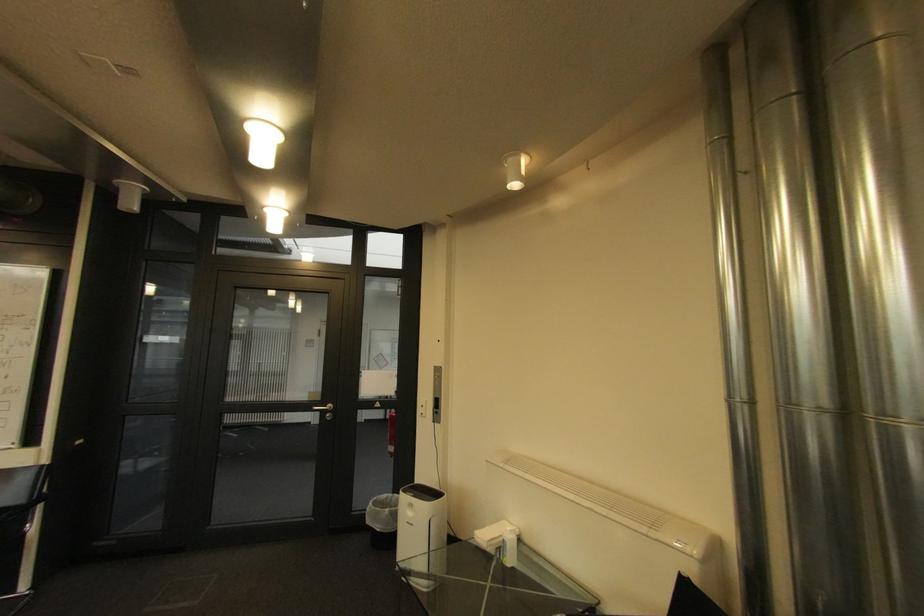
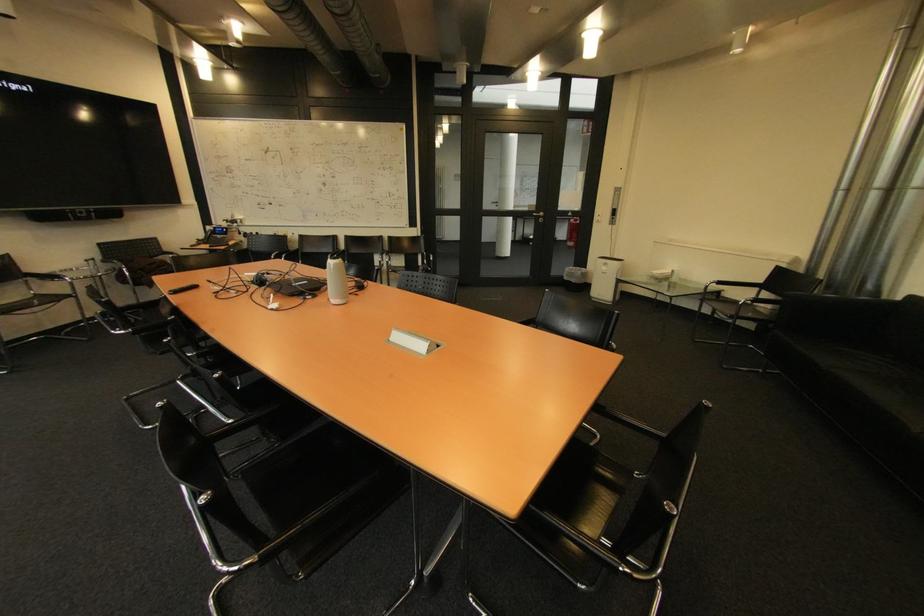
Where in the second image is the point corresponding to point (377, 523) from the first image?

(574, 280)